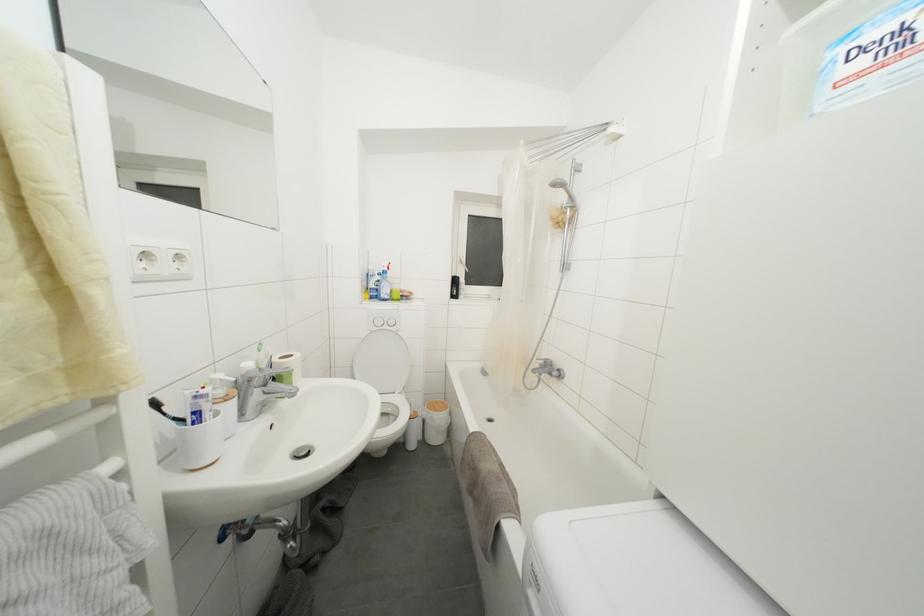
The location [383,286] corresponds to which object?

This point indicates the blue spray bottle.